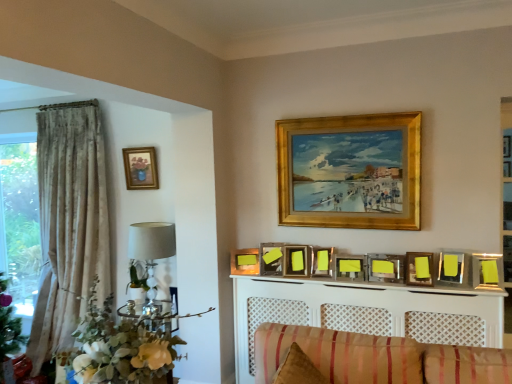
Question: Could you tell me if green leafy floral arrangement at left is turned towards matte gold picture frame at upper left, the 11th picture frame when ordered from right to left?

Choices:
 (A) no
 (B) yes

Answer: (A)

Question: Is matte gold picture frame at upper left, the 11th picture frame when ordered from right to left, surrounded by green leafy floral arrangement at left?

Choices:
 (A) no
 (B) yes

Answer: (A)

Question: Is green leafy floral arrangement at left positioned beyond the bounds of matte gold picture frame at upper left, the 11th picture frame when ordered from right to left?

Choices:
 (A) no
 (B) yes

Answer: (B)

Question: Can you confirm if green leafy floral arrangement at left is positioned to the left of matte gold picture frame at upper left, the 1th picture frame positioned from the left?

Choices:
 (A) yes
 (B) no

Answer: (B)

Question: From the image's perspective, would you say green leafy floral arrangement at left is shown under matte gold picture frame at upper left, the 1th picture frame positioned from the left?

Choices:
 (A) yes
 (B) no

Answer: (A)

Question: Is gold wooden picture frame at upper center, the sixth picture frame when ordered from right to left, bigger or smaller than yellow matte picture frame at upper center, which ranks as the second picture frame in right-to-left order?

Choices:
 (A) big
 (B) small

Answer: (A)

Question: In the image, is gold wooden picture frame at upper center, the sixth picture frame from the left, positioned in front of or behind yellow matte picture frame at upper center, which ranks as the second picture frame in right-to-left order?

Choices:
 (A) behind
 (B) front

Answer: (A)

Question: Visually, is gold wooden picture frame at upper center, the sixth picture frame from the left, positioned to the left or to the right of yellow matte picture frame at upper center, which ranks as the second picture frame in right-to-left order?

Choices:
 (A) left
 (B) right

Answer: (A)

Question: From a real-world perspective, relative to yellow matte picture frame at upper center, which ranks as the second picture frame in right-to-left order, is gold wooden picture frame at upper center, the sixth picture frame from the left, vertically above or below?

Choices:
 (A) above
 (B) below

Answer: (A)

Question: From a real-world perspective, is white lattice fireplace at center positioned above or below matte wood picture frame at upper center, the eighth picture frame in the right-to-left sequence?

Choices:
 (A) below
 (B) above

Answer: (A)

Question: Is white lattice fireplace at center bigger or smaller than matte wood picture frame at upper center, positioned as the fourth picture frame in left-to-right order?

Choices:
 (A) big
 (B) small

Answer: (A)

Question: Is point (429, 321) closer or farther from the camera than point (307, 246)?

Choices:
 (A) closer
 (B) farther

Answer: (A)

Question: From their relative heights in the image, would you say white lattice fireplace at center is taller or shorter than matte wood picture frame at upper center, the eighth picture frame in the right-to-left sequence?

Choices:
 (A) short
 (B) tall

Answer: (B)

Question: Is green leafy floral arrangement at left to the left or to the right of yellow matte picture frame at center, arranged as the 5th picture frame when viewed from the right, in the image?

Choices:
 (A) left
 (B) right

Answer: (A)

Question: From a real-world perspective, is green leafy floral arrangement at left above or below yellow matte picture frame at center, arranged as the 5th picture frame when viewed from the right?

Choices:
 (A) above
 (B) below

Answer: (B)